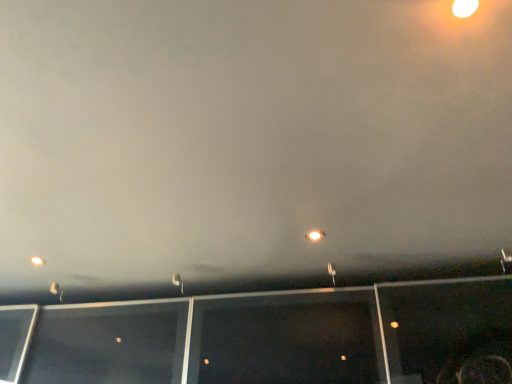
Question: Could you tell me if metallic street light at lower left, the 1th street light from the bottom, is facing metallic silver street light at center, positioned as the third street light in bottom-to-top order?

Choices:
 (A) no
 (B) yes

Answer: (A)

Question: Does metallic street light at lower left, placed as the 1th street light when sorted from back to front, have a smaller size compared to metallic silver street light at center, the 3th street light when ordered from back to front?

Choices:
 (A) no
 (B) yes

Answer: (B)

Question: Does metallic street light at lower left, placed as the 1th street light when sorted from back to front, touch metallic silver street light at center, marked as the second street light in a top-to-bottom arrangement?

Choices:
 (A) no
 (B) yes

Answer: (A)

Question: Does metallic street light at lower left, placed as the 1th street light when sorted from back to front, have a lesser width compared to metallic silver street light at center, marked as the second street light in a top-to-bottom arrangement?

Choices:
 (A) no
 (B) yes

Answer: (B)

Question: From a real-world perspective, is metallic street light at lower left, placed as the 1th street light when sorted from back to front, below metallic silver street light at center, the second street light when ordered from front to back?

Choices:
 (A) no
 (B) yes

Answer: (B)

Question: Considering the positions of point (332, 276) and point (53, 284), is point (332, 276) closer or farther from the camera than point (53, 284)?

Choices:
 (A) farther
 (B) closer

Answer: (B)

Question: From their relative heights in the image, would you say metallic silver street light at center, the second street light when ordered from front to back, is taller or shorter than metallic street light at lower left, placed as the 1th street light when sorted from back to front?

Choices:
 (A) short
 (B) tall

Answer: (B)

Question: Is metallic silver street light at center, the second street light when ordered from front to back, spatially inside metallic street light at lower left, which ranks as the fourth street light in right-to-left order, or outside of it?

Choices:
 (A) outside
 (B) inside

Answer: (A)

Question: Would you say metallic silver street light at center, the 4th street light positioned from the left, is to the left or to the right of metallic street light at lower left, placed as the 1th street light when sorted from back to front, in the picture?

Choices:
 (A) left
 (B) right

Answer: (B)

Question: From a real-world perspective, is white plastic street light at center, the second street light positioned from the bottom, above or below metallic street light at lower left, the 1th street light from the bottom?

Choices:
 (A) above
 (B) below

Answer: (A)

Question: Considering the positions of white plastic street light at center, the second street light positioned from the bottom, and metallic street light at lower left, the 1th street light from the bottom, in the image, is white plastic street light at center, the second street light positioned from the bottom, taller or shorter than metallic street light at lower left, the 1th street light from the bottom,?

Choices:
 (A) tall
 (B) short

Answer: (A)

Question: Considering the relative positions of white plastic street light at center, which appears as the second street light when viewed from the back, and metallic street light at lower left, which ranks as the fourth street light in right-to-left order, in the image provided, is white plastic street light at center, which appears as the second street light when viewed from the back, to the left or to the right of metallic street light at lower left, which ranks as the fourth street light in right-to-left order,?

Choices:
 (A) right
 (B) left

Answer: (A)

Question: Relative to metallic street light at lower left, placed as the 1th street light when sorted from back to front, is white plastic street light at center, the second street light positioned from the bottom, in front or behind?

Choices:
 (A) front
 (B) behind

Answer: (A)

Question: Is point (57, 291) positioned closer to the camera than point (182, 294)?

Choices:
 (A) farther
 (B) closer

Answer: (A)

Question: Considering the positions of metallic street light at lower left, placed as the 1th street light when sorted from back to front, and white plastic street light at center, which appears as the second street light when viewed from the back, in the image, is metallic street light at lower left, placed as the 1th street light when sorted from back to front, bigger or smaller than white plastic street light at center, which appears as the second street light when viewed from the back,?

Choices:
 (A) small
 (B) big

Answer: (A)